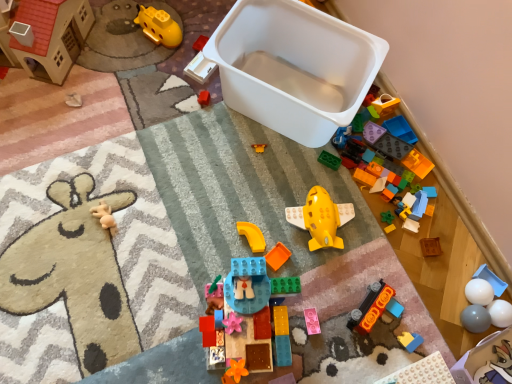
Find the location of a particular element. The height and width of the screenshot is (384, 512). free space that is in between pink matte block at center, the 7th toy from the left, and white plastic tray at upper center, acting as the fourth toy starting from the left is located at coordinates point(249,182).